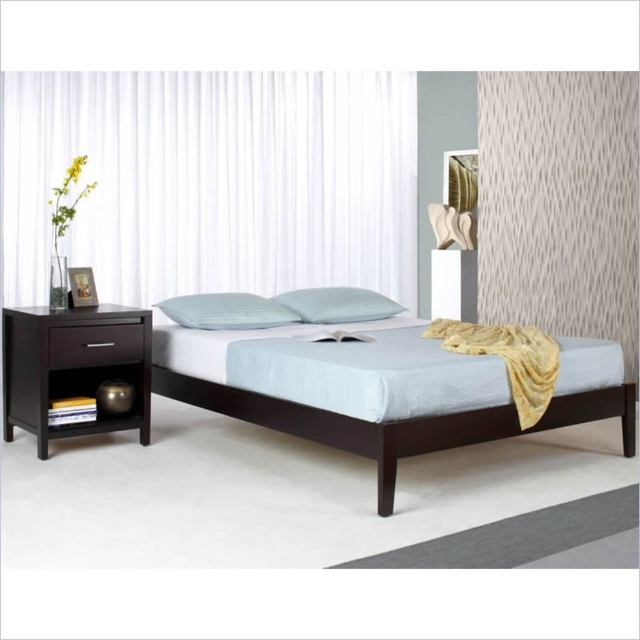
You are trying to decide whether to place a tall floor lamp in the bedroom. The lamp is 1.8 meters tall. Considering the dark wood bed at center and the white quilted pillow at center, which object is taller and can the lamp fit without touching the ceiling?

The dark wood bed at center is much taller than the white quilted pillow at center. Since the bed is already taller than the pillow, and the lamp is 1.8 meters tall, it should fit as long as the ceiling height allows, but the description does not provide ceiling height details.

In the scene shown: You are designing a new room layout and want to place a 10 cm thick decorative object between the white textured curtain at upper right and the light blue fabric pillow at center. Can you fit it there based on their thickness?

The white textured curtain at upper right is thinner than the light blue fabric pillow at center. Since the decorative object is 10 cm thick, you need to ensure there is enough space between them. However, the description only provides relative thickness information but not the exact dimensions of the space between the objects. Without knowing the distance between them, it is impossible to determine if the 10 cm thick object will fit.

You are a delivery person who needs to place a package that is 22 inches long between the dark wood bed at center and the white quilted pillow at center. Can you fit the package in that space?

The distance between the dark wood bed at center and the white quilted pillow at center is 21.79 inches, which is slightly shorter than the 22 inch package. Therefore, the package cannot fit in that space.